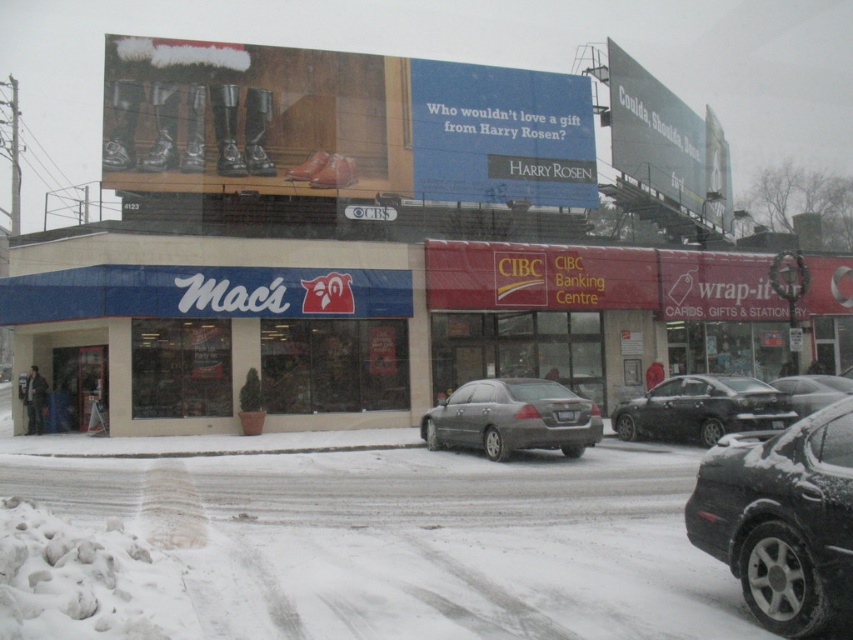
Who is lower down, shiny black sedan at lower right or metallic silver sedan at center?

metallic silver sedan at center is lower down.

Does shiny black sedan at lower right have a lesser width compared to metallic silver sedan at center?

Incorrect, shiny black sedan at lower right's width is not less than metallic silver sedan at center's.

You are a GUI agent. You are given a task and a screenshot of the screen. Output one action in this format:
    pyautogui.click(x=<x>, y=<y>)
    Task: Click on the shiny black sedan at lower right
    
    Given the screenshot: What is the action you would take?
    pyautogui.click(x=782, y=518)

This screenshot has width=853, height=640. Find the location of `shiny black sedan at lower right`. shiny black sedan at lower right is located at coordinates (782, 518).

The width and height of the screenshot is (853, 640). What do you see at coordinates (782, 518) in the screenshot?
I see `shiny black sedan at lower right` at bounding box center [782, 518].

Is point (780, 480) farther from viewer compared to point (517, 449)?

That is False.

In order to click on shiny black sedan at lower right in this screenshot , I will do `click(782, 518)`.

In the scene shown: Measure the distance between matte gray sedan at center and metallic silver sedan at center.

matte gray sedan at center and metallic silver sedan at center are 7.99 meters apart.

Is the position of matte gray sedan at center more distant than that of metallic silver sedan at center?

No, it is not.

This screenshot has width=853, height=640. In order to click on matte gray sedan at center in this screenshot , I will do `click(512, 419)`.